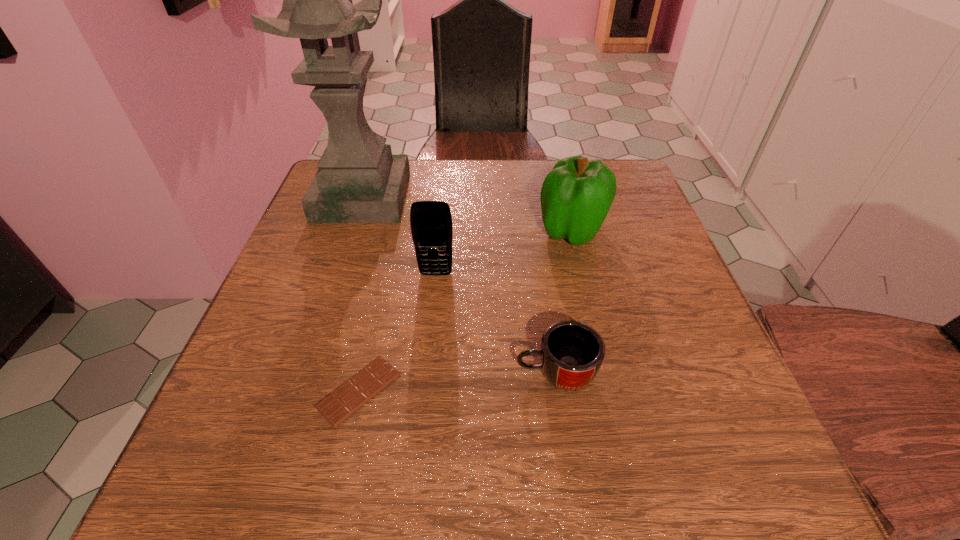
Locate an element on the screen. The height and width of the screenshot is (540, 960). free spot at the far edge of the desktop is located at coordinates (411, 195).

Locate an element on the screen. vacant space at the near edge is located at coordinates (636, 463).

This screenshot has width=960, height=540. I want to click on blank space at the left edge, so click(252, 374).

The width and height of the screenshot is (960, 540). What are the coordinates of `free location at the right edge of the desktop` in the screenshot? It's located at (646, 393).

In the image, there is a desktop. Identify the location of vacant space at the near left corner. Image resolution: width=960 pixels, height=540 pixels. pyautogui.click(x=283, y=501).

This screenshot has height=540, width=960. In order to click on blank region between the third object from left to right and the bell pepper in this screenshot , I will do `click(504, 252)`.

The height and width of the screenshot is (540, 960). What are the coordinates of `unoccupied position between the bell pepper and the fourth tallest object` in the screenshot? It's located at (564, 302).

At what (x,y) coordinates should I click in order to perform the action: click on empty space between the shortest object and the sculpture. Please return your answer as a coordinate pair (x, y). The height and width of the screenshot is (540, 960). Looking at the image, I should click on (361, 294).

I want to click on free spot between the sculpture and the bell pepper, so click(468, 214).

This screenshot has width=960, height=540. In order to click on free space between the chocolate bar and the fourth tallest object in this screenshot , I will do `click(457, 382)`.